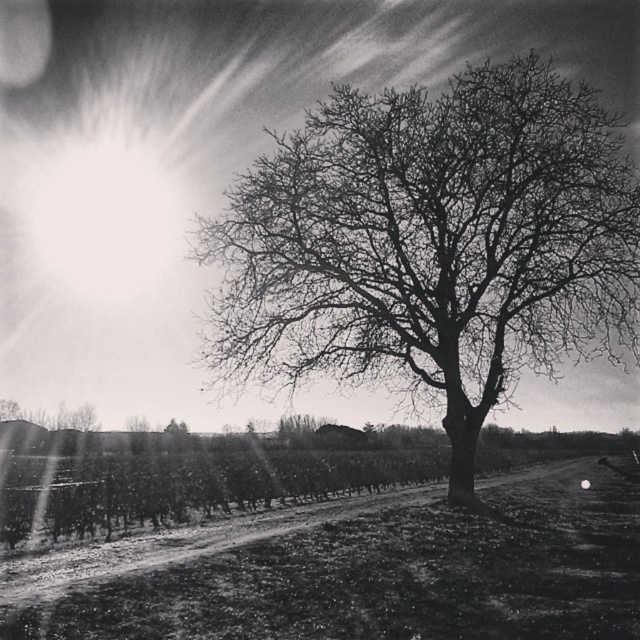
Question: Can you confirm if bare branches at center is smaller than dirt ground at center?

Choices:
 (A) no
 (B) yes

Answer: (A)

Question: Does bare branches at center have a larger size compared to dirt ground at center?

Choices:
 (A) yes
 (B) no

Answer: (A)

Question: Which point is farther to the camera?

Choices:
 (A) dirt ground at center
 (B) bare branches at center

Answer: (B)

Question: Can you confirm if bare branches at center is positioned below dirt ground at center?

Choices:
 (A) no
 (B) yes

Answer: (A)